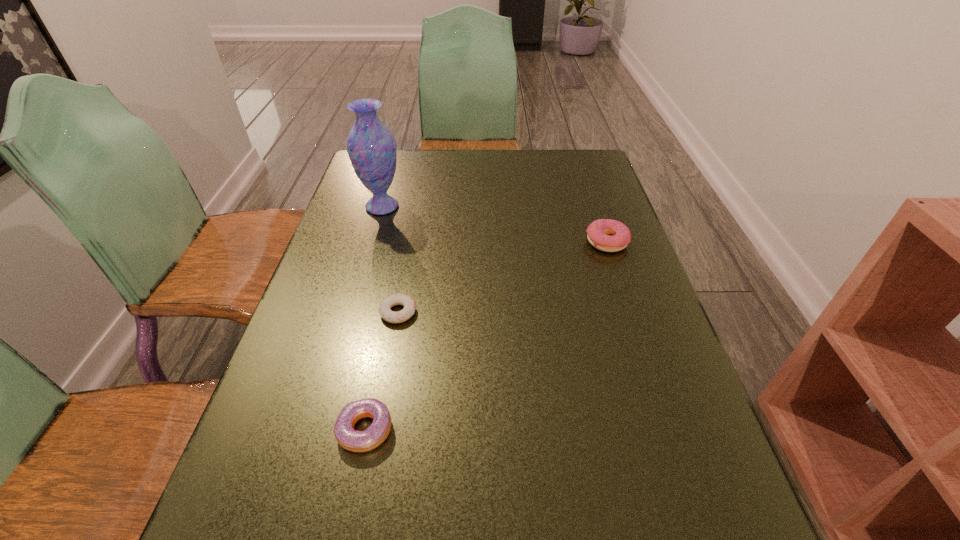
This screenshot has width=960, height=540. Find the location of `vase`. vase is located at coordinates (371, 146).

You are a GUI agent. You are given a task and a screenshot of the screen. Output one action in this format:
    pyautogui.click(x=<x>, y=<y>)
    Task: Click on the tallest object
    Image resolution: width=960 pixels, height=540 pixels.
    Given the screenshot: What is the action you would take?
    pyautogui.click(x=371, y=146)

Image resolution: width=960 pixels, height=540 pixels. I want to click on the rightmost doughnut, so click(598, 231).

Find the location of `the third nearest object`. the third nearest object is located at coordinates (598, 231).

What are the coordinates of `the nearest object` in the screenshot? It's located at (347, 437).

I want to click on the second nearest doughnut, so click(409, 304).

Where is `the shortest doughnut`? This screenshot has height=540, width=960. the shortest doughnut is located at coordinates (409, 304).

The height and width of the screenshot is (540, 960). I want to click on free space located on the front of the farthest object, so click(x=352, y=310).

Find the location of a particular element. Image resolution: width=960 pixels, height=540 pixels. vacant space located on the front of the rightmost object is located at coordinates (616, 269).

At what (x,y) coordinates should I click in order to perform the action: click on vacant area situated 0.050m on the back of the nearest doughnut. Please return your answer as a coordinate pair (x, y). Looking at the image, I should click on (374, 383).